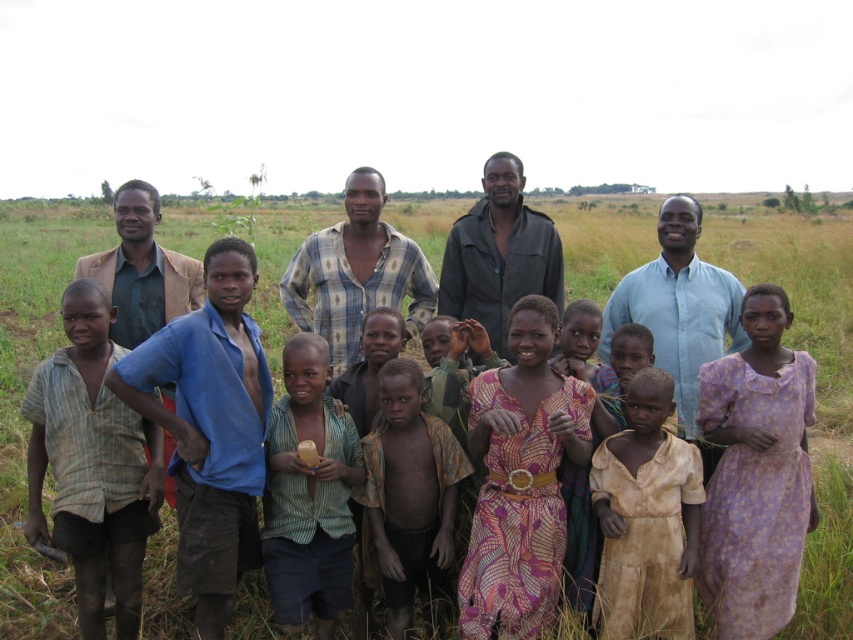
Question: Can you confirm if dark green jacket at center is positioned to the left of brown textured jacket at left?

Choices:
 (A) yes
 (B) no

Answer: (B)

Question: Is brown textured dress at center wider than blue plaid shirt at center?

Choices:
 (A) yes
 (B) no

Answer: (B)

Question: Which of the following is the closest to the observer?

Choices:
 (A) printed fabric dress at center
 (B) blue plaid shirt at center
 (C) brown textured dress at center

Answer: (A)

Question: Which point is farther to the camera?

Choices:
 (A) blue cotton shirt at center
 (B) dirty striped shirt at left
 (C) brown textured jacket at left

Answer: (C)

Question: Estimate the real-world distances between objects in this image. Which object is closer to the purple floral dress at center?

Choices:
 (A) light blue shirt at center
 (B) brown textured jacket at left

Answer: (A)

Question: Considering the relative positions of dirty striped shirt at left and printed fabric dress at center in the image provided, where is dirty striped shirt at left located with respect to printed fabric dress at center?

Choices:
 (A) right
 (B) left

Answer: (B)